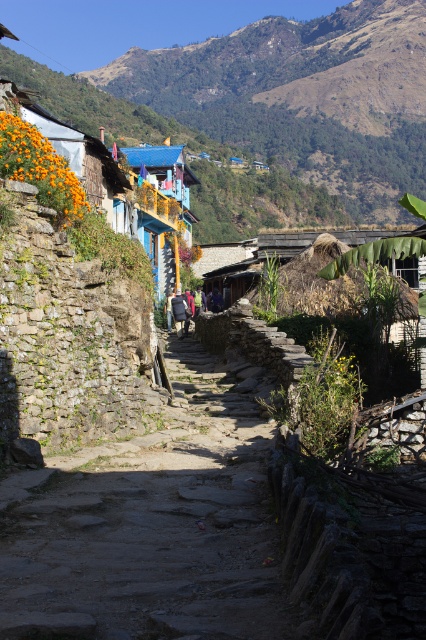
Can you confirm if natural stone path at center is thinner than matte orange wall at left?

Correct, natural stone path at center's width is less than matte orange wall at left's.

Can you confirm if natural stone path at center is taller than matte orange wall at left?

No, natural stone path at center is not taller than matte orange wall at left.

Where is `natural stone path at center`? natural stone path at center is located at coordinates (152, 525).